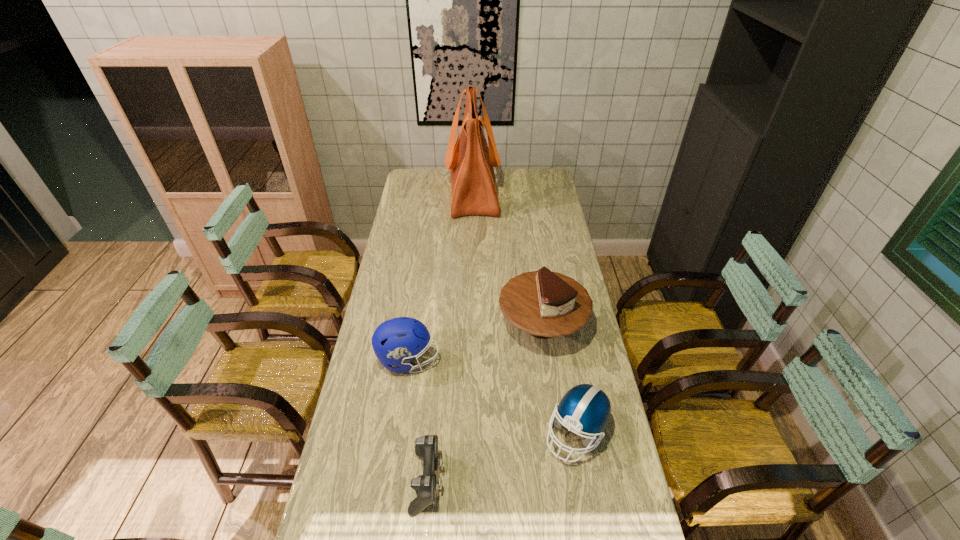
You are a GUI agent. You are given a task and a screenshot of the screen. Output one action in this format:
    pyautogui.click(x=<x>, y=<y>)
    Task: Click on the vacant position located at the front of the nearer football helmet with the faceguard
    This screenshot has width=960, height=540.
    Given the screenshot: What is the action you would take?
    pyautogui.click(x=588, y=501)

This screenshot has width=960, height=540. Identify the location of vacant space located 0.320m on the surface of the shortest object with buttons. (561, 480).

The height and width of the screenshot is (540, 960). I want to click on object at the far edge, so click(471, 160).

The image size is (960, 540). I want to click on object present at the left edge, so click(397, 341).

This screenshot has height=540, width=960. Identify the location of cake at the right edge. (545, 304).

At what (x,y) coordinates should I click in order to perform the action: click on football helmet that is at the right edge. Please return your answer as a coordinate pair (x, y). The width and height of the screenshot is (960, 540). Looking at the image, I should click on pos(585,408).

At what (x,y) coordinates should I click in order to perform the action: click on vacant region at the left edge. Please return your answer as a coordinate pair (x, y). The image size is (960, 540). Looking at the image, I should click on (420, 246).

You are a GUI agent. You are given a task and a screenshot of the screen. Output one action in this format:
    pyautogui.click(x=<x>, y=<y>)
    Task: Click on the vacant space at the right edge of the desktop
    The image size is (960, 540).
    Given the screenshot: What is the action you would take?
    pyautogui.click(x=616, y=465)

Where is `free spot at the far left corner of the desktop`? The height and width of the screenshot is (540, 960). free spot at the far left corner of the desktop is located at coordinates (429, 180).

Locate an element on the screen. This screenshot has width=960, height=540. vacant space at the far right corner is located at coordinates (555, 180).